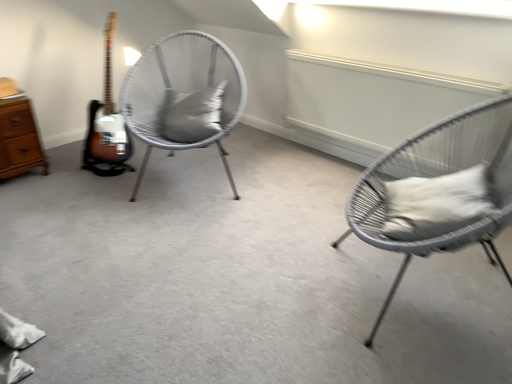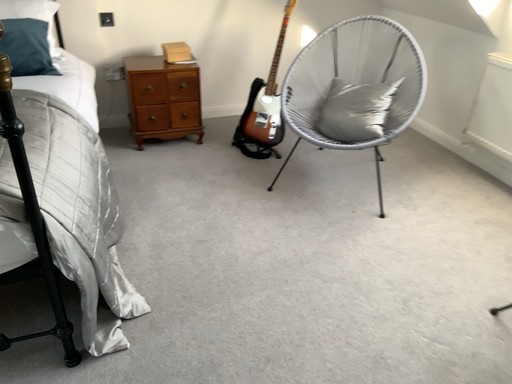
Question: Which way did the camera rotate in the video?

Choices:
 (A) rotated left
 (B) rotated right

Answer: (A)